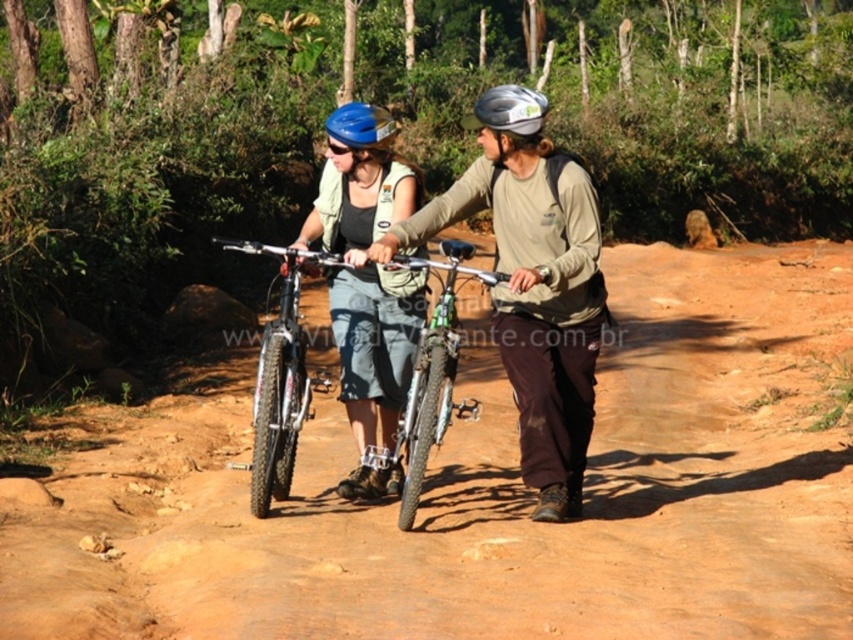
Which is above, brown dirt track at center or shiny black frame at center?

shiny black frame at center is higher up.

Can you confirm if brown dirt track at center is positioned above shiny black frame at center?

Incorrect, brown dirt track at center is not positioned above shiny black frame at center.

Is point (294, 612) closer to viewer compared to point (281, 257)?

Yes, it is.

What are the coordinates of `brown dirt track at center` in the screenshot? It's located at (485, 493).

How distant is brown dirt track at center from matte blue helmet at center?

brown dirt track at center is 9.18 feet away from matte blue helmet at center.

Which of these two, brown dirt track at center or matte blue helmet at center, stands taller?

Standing taller between the two is matte blue helmet at center.

Is point (21, 563) closer to camera compared to point (415, 310)?

Yes, point (21, 563) is in front of point (415, 310).

This screenshot has height=640, width=853. In order to click on brown dirt track at center in this screenshot , I will do `click(485, 493)`.

Can you confirm if shiny black frame at center is positioned to the right of blue matte bicycle helmet at center?

No, shiny black frame at center is not to the right of blue matte bicycle helmet at center.

Who is more distant from viewer, (287, 412) or (384, 112)?

The point (384, 112) is more distant.

What do you see at coordinates (280, 378) in the screenshot?
I see `shiny black frame at center` at bounding box center [280, 378].

Locate an element on the screen. shiny black frame at center is located at coordinates (280, 378).